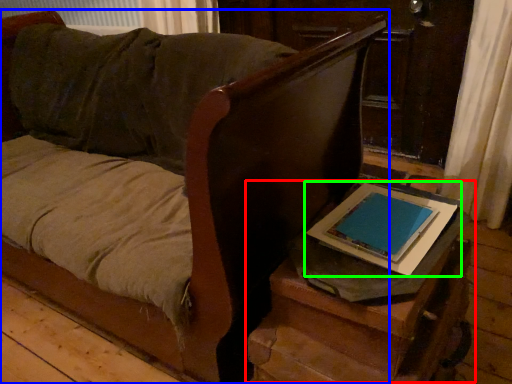
Question: Which is farther away from table (highlighted by a red box)? furniture (highlighted by a blue box) or tablet computer (highlighted by a green box)?

Choices:
 (A) furniture
 (B) tablet computer

Answer: (A)